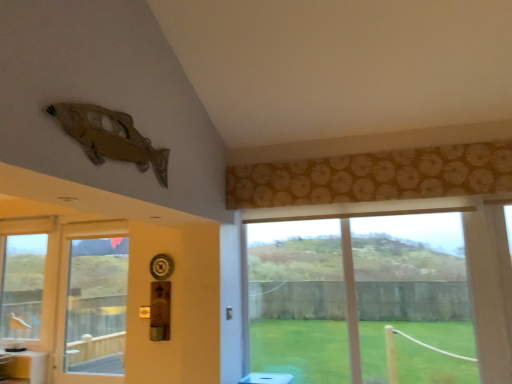
Find the location of `transparent glass door at left`. transparent glass door at left is located at coordinates (97, 306).

Identify the location of matte brown curtain at upper center. (354, 293).

The image size is (512, 384). What do you see at coordinates (354, 293) in the screenshot?
I see `matte brown curtain at upper center` at bounding box center [354, 293].

What do you see at coordinates (26, 355) in the screenshot? The image size is (512, 384). I see `white glossy counter top at lower left` at bounding box center [26, 355].

I want to click on transparent glass door at left, so click(97, 306).

From a real-world perspective, which object rests below the other?

From a 3D spatial view, metallic brass door handle at lower center is below.

Is metallic brass door handle at lower center shorter than transparent glass door at left?

Indeed, metallic brass door handle at lower center has a lesser height compared to transparent glass door at left.

Considering the sizes of objects metallic brass door handle at lower center and transparent glass door at left in the image provided, who is bigger, metallic brass door handle at lower center or transparent glass door at left?

transparent glass door at left is bigger.

Does point (226, 316) come farther from viewer compared to point (126, 275)?

No, it is not.

Can you tell me how much matte brown curtain at upper center and metallic brass door handle at lower center differ in facing direction?

91.9 degrees.

Is matte brown curtain at upper center directly adjacent to metallic brass door handle at lower center?

matte brown curtain at upper center and metallic brass door handle at lower center are not in contact.

Is matte brown curtain at upper center located outside metallic brass door handle at lower center?

Indeed, matte brown curtain at upper center is completely outside metallic brass door handle at lower center.

From a real-world perspective, who is located lower, matte brown curtain at upper center or metallic brass door handle at lower center?

In real-world perspective, metallic brass door handle at lower center is lower.

From a real-world perspective, relative to transparent glass door at left, is matte brown curtain at upper center vertically above or below?

In terms of real-world spatial position, matte brown curtain at upper center is above transparent glass door at left.

Are matte brown curtain at upper center and transparent glass door at left beside each other?

No, matte brown curtain at upper center is not next to transparent glass door at left.

Measure the distance from matte brown curtain at upper center to transparent glass door at left.

The distance of matte brown curtain at upper center from transparent glass door at left is 5.86 feet.

Does matte brown curtain at upper center come behind transparent glass door at left?

No, it is in front of transparent glass door at left.

Which of these two, transparent glass door at left or white glossy counter top at lower left, is smaller?

white glossy counter top at lower left.

Is transparent glass door at left positioned with its back to white glossy counter top at lower left?

No, transparent glass door at left's orientation is not away from white glossy counter top at lower left.

Considering the relative sizes of transparent glass door at left and white glossy counter top at lower left in the image provided, is transparent glass door at left thinner than white glossy counter top at lower left?

Indeed, transparent glass door at left has a lesser width compared to white glossy counter top at lower left.

Does transparent glass door at left touch white glossy counter top at lower left?

No, transparent glass door at left is not next to white glossy counter top at lower left.

Does transparent glass door at left have a lesser width compared to metallic brass door handle at lower center?

No.

Is transparent glass door at left facing towards metallic brass door handle at lower center?

No, transparent glass door at left is not aimed at metallic brass door handle at lower center.

Can we say transparent glass door at left lies outside metallic brass door handle at lower center?

Yes.

Is transparent glass door at left at the right side of metallic brass door handle at lower center?

Incorrect, transparent glass door at left is not on the right side of metallic brass door handle at lower center.

Considering the relative positions of metallic brass door handle at lower center and matte brown curtain at upper center in the image provided, is metallic brass door handle at lower center to the right of matte brown curtain at upper center from the viewer's perspective?

No, metallic brass door handle at lower center is not to the right of matte brown curtain at upper center.

Is metallic brass door handle at lower center taller than matte brown curtain at upper center?

No, metallic brass door handle at lower center is not taller than matte brown curtain at upper center.

Relative to matte brown curtain at upper center, is metallic brass door handle at lower center in front or behind?

Clearly, metallic brass door handle at lower center is behind matte brown curtain at upper center.

In terms of width, does metallic brass door handle at lower center look wider or thinner when compared to matte brown curtain at upper center?

Clearly, metallic brass door handle at lower center has less width compared to matte brown curtain at upper center.

The image size is (512, 384). I want to click on door handle above the white glossy counter top at lower left (from the image's perspective), so click(x=229, y=313).

From the image's perspective, between white glossy counter top at lower left and metallic brass door handle at lower center, which one is located above?

metallic brass door handle at lower center, from the image's perspective.

Considering the positions of objects white glossy counter top at lower left and metallic brass door handle at lower center in the image provided, who is in front, white glossy counter top at lower left or metallic brass door handle at lower center?

metallic brass door handle at lower center.

Does white glossy counter top at lower left have a greater height compared to metallic brass door handle at lower center?

No, white glossy counter top at lower left is not taller than metallic brass door handle at lower center.

Where is `door handle on the right of the transparent glass door at left`? This screenshot has height=384, width=512. door handle on the right of the transparent glass door at left is located at coordinates (229, 313).

Where is `window above the metallic brass door handle at lower center (from the image's perspective)`? window above the metallic brass door handle at lower center (from the image's perspective) is located at coordinates (354, 293).

Looking at the image, which one is located further to white glossy counter top at lower left, metallic brass door handle at lower center or matte brown curtain at upper center?

matte brown curtain at upper center.

From the image, which object appears to be nearer to matte brown curtain at upper center, metallic brass door handle at lower center or transparent glass door at left?

The object closer to matte brown curtain at upper center is metallic brass door handle at lower center.

When comparing their distances from transparent glass door at left, does metallic brass door handle at lower center or matte brown curtain at upper center seem further?

The object further to transparent glass door at left is matte brown curtain at upper center.

Considering their positions, is white glossy counter top at lower left positioned further to matte brown curtain at upper center than transparent glass door at left?

The object further to matte brown curtain at upper center is white glossy counter top at lower left.

Considering their positions, is matte brown curtain at upper center positioned closer to metallic brass door handle at lower center than transparent glass door at left?

matte brown curtain at upper center lies closer to metallic brass door handle at lower center than the other object.

From the image, which object appears to be farther from transparent glass door at left, matte brown curtain at upper center or metallic brass door handle at lower center?

Based on the image, matte brown curtain at upper center appears to be further to transparent glass door at left.

Considering their positions, is white glossy counter top at lower left positioned closer to transparent glass door at left than metallic brass door handle at lower center?

white glossy counter top at lower left lies closer to transparent glass door at left than the other object.

From the image, which object appears to be farther from white glossy counter top at lower left, metallic brass door handle at lower center or transparent glass door at left?

metallic brass door handle at lower center.

Locate an element on the screen. Image resolution: width=512 pixels, height=384 pixels. window screen located between white glossy counter top at lower left and matte brown curtain at upper center in the left-right direction is located at coordinates (97, 306).

Find the location of a particular element. window screen between white glossy counter top at lower left and metallic brass door handle at lower center from left to right is located at coordinates (97, 306).

This screenshot has width=512, height=384. I want to click on door handle between white glossy counter top at lower left and matte brown curtain at upper center in the horizontal direction, so click(229, 313).

The image size is (512, 384). I want to click on door handle between transparent glass door at left and matte brown curtain at upper center from left to right, so click(229, 313).